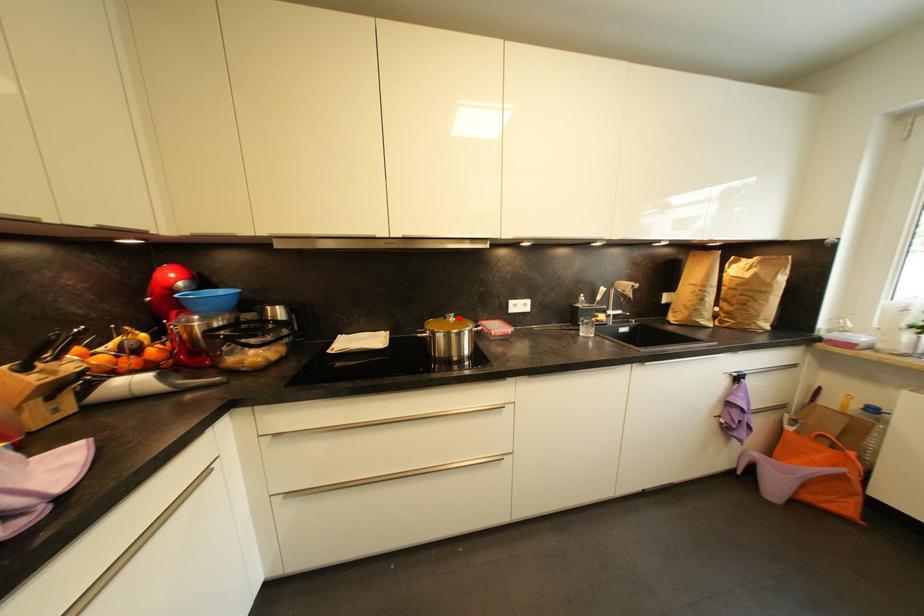
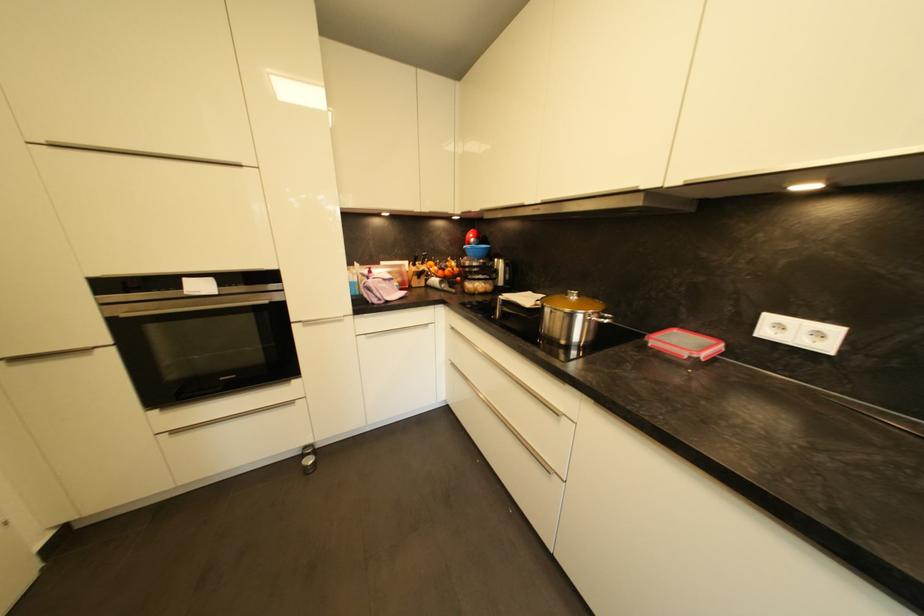
Where in the second image is the point corresponding to the highlighted location from the first image?

(584, 298)